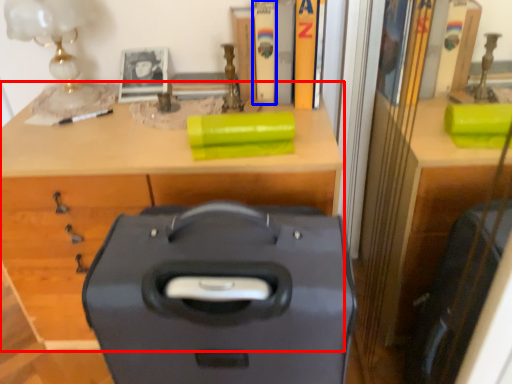
Question: Which object is closer to the camera taking this photo, desk (highlighted by a red box) or book (highlighted by a blue box)?

Choices:
 (A) desk
 (B) book

Answer: (A)